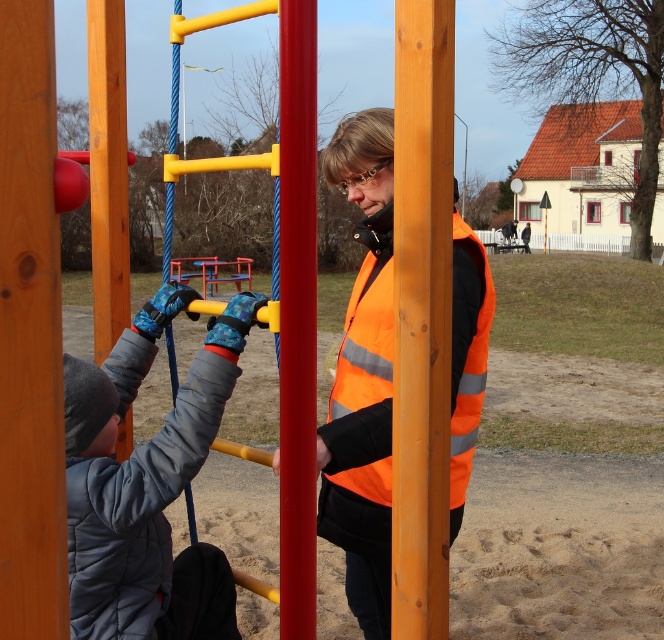
You are a visitor at the playground and want to locate the adult wearing the orange reflective safety vest at center. Which direction should you look from the gray fleece jacket at left?

The gray fleece jacket at left is positioned on the left side of orange reflective safety vest at center, so you should look to the right from the gray fleece jacket at left to find the orange reflective safety vest at center.

You are a parent at the playground and want to ensure the gray fleece jacket at left and the wooden pole at center are visible to both the child and yourself. Which object will appear bigger to the child when looking from their current position on the monkey bars?

The gray fleece jacket at left appears larger to the child because it has a larger size compared to the wooden pole at center.

You are standing at the point marked by coordinates point [145,483]. What object is directly beneath you?

The point [145,483] is on gray fleece jacket at left.